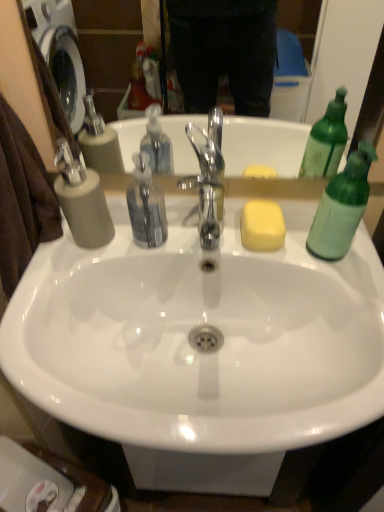
Where is `blank space to the left of green translucent bottle at right`? The image size is (384, 512). blank space to the left of green translucent bottle at right is located at coordinates (254, 247).